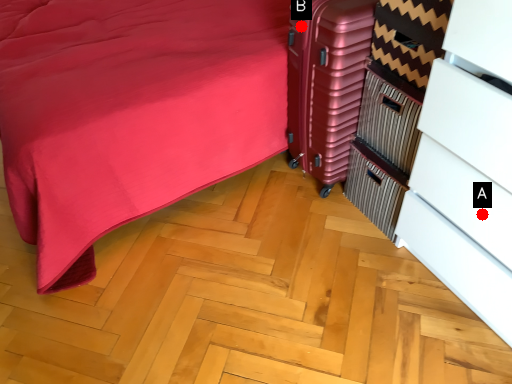
Question: Two points are circled on the image, labeled by A and B beside each circle. Which point is closer to the camera?

Choices:
 (A) A is closer
 (B) B is closer

Answer: (A)